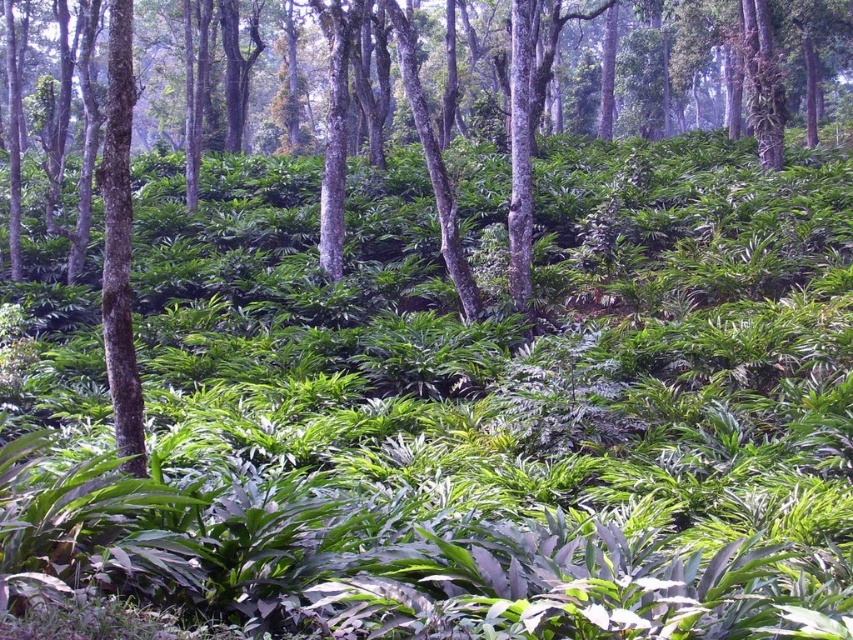
You are a hiker who wants to take a photo of the green leafy plant at center and the smooth bark tree at left. Which object should you focus on first if you want to capture both in the same frame?

The green leafy plant at center is positioned on the right side of smooth bark tree at left, so you should focus on the smooth bark tree at left first to ensure both are in the frame.